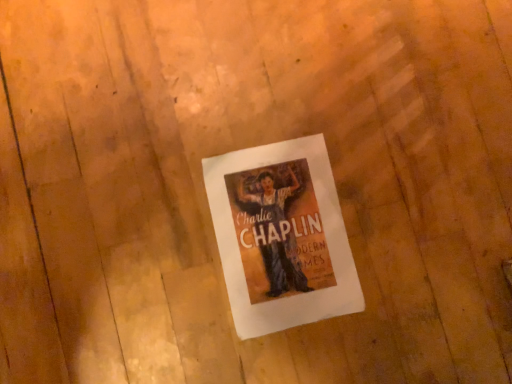
The height and width of the screenshot is (384, 512). What are the coordinates of `unoccupied area behind white paper at center` in the screenshot? It's located at (353, 118).